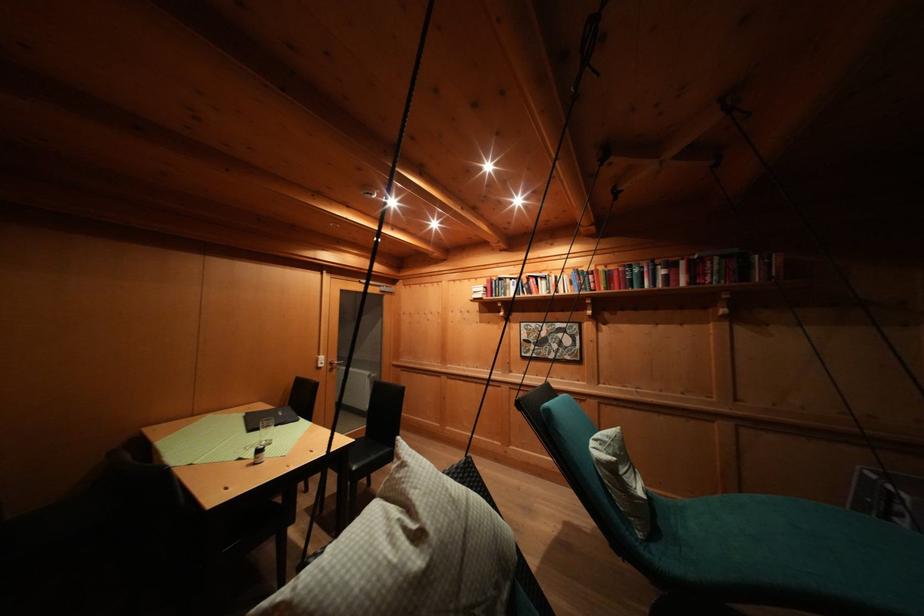
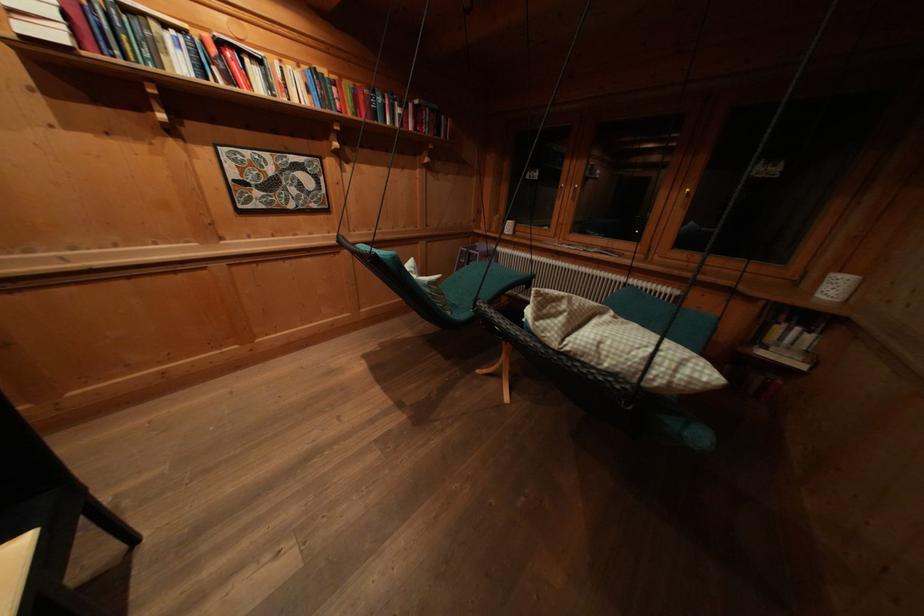
Where in the second image is the point corresponding to point 642,275 from the first image?

(385, 103)